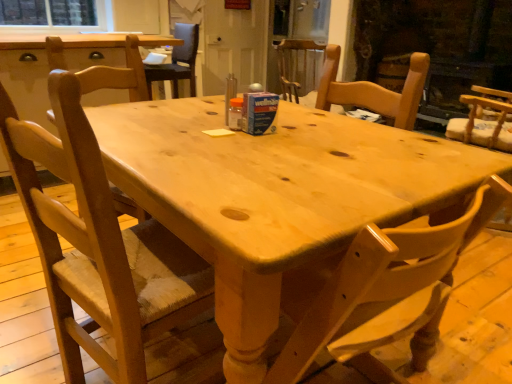
Question: Which direction should I rotate to face white glossy door at upper center, which ranks as the 1th screen door in left-to-right order, — up or down?

Choices:
 (A) down
 (B) up

Answer: (B)

Question: Does light wood chair at center, which is the first chair from back to front, have a lesser height compared to clear glass window screen at upper left?

Choices:
 (A) yes
 (B) no

Answer: (B)

Question: Is clear glass window screen at upper left surrounded by light wood chair at center, which is the second chair from right to left?

Choices:
 (A) no
 (B) yes

Answer: (A)

Question: Is light wood chair at center, acting as the fifth chair starting from the front, turned away from clear glass window screen at upper left?

Choices:
 (A) no
 (B) yes

Answer: (A)

Question: Is light wood chair at center, acting as the fifth chair starting from the front, positioned behind clear glass window screen at upper left?

Choices:
 (A) no
 (B) yes

Answer: (A)

Question: Are light wood chair at center, which is the second chair from right to left, and clear glass window screen at upper left beside each other?

Choices:
 (A) no
 (B) yes

Answer: (A)

Question: Could you tell me if light wood chair at center, acting as the fifth chair starting from the front, is facing clear glass window screen at upper left?

Choices:
 (A) no
 (B) yes

Answer: (A)

Question: From the image's perspective, would you say transparent glass screen door at upper center, which ranks as the 1th screen door in right-to-left order, is shown under white glossy door at upper center, positioned as the second screen door in right-to-left order?

Choices:
 (A) no
 (B) yes

Answer: (B)

Question: Does transparent glass screen door at upper center, which is the second screen door in left-to-right order, lie behind white glossy door at upper center, which ranks as the 1th screen door in left-to-right order?

Choices:
 (A) yes
 (B) no

Answer: (B)

Question: From a real-world perspective, is transparent glass screen door at upper center, which is the second screen door in left-to-right order, positioned under white glossy door at upper center, positioned as the second screen door in right-to-left order, based on gravity?

Choices:
 (A) yes
 (B) no

Answer: (B)

Question: Is transparent glass screen door at upper center, which ranks as the 1th screen door in right-to-left order, facing away from white glossy door at upper center, positioned as the second screen door in right-to-left order?

Choices:
 (A) no
 (B) yes

Answer: (A)

Question: Are transparent glass screen door at upper center, which ranks as the 1th screen door in right-to-left order, and white glossy door at upper center, positioned as the second screen door in right-to-left order, making contact?

Choices:
 (A) yes
 (B) no

Answer: (B)

Question: Would you say white glossy door at upper center, positioned as the second screen door in right-to-left order, is part of transparent glass screen door at upper center, which is the second screen door in left-to-right order,'s contents?

Choices:
 (A) no
 (B) yes

Answer: (A)

Question: Considering the relative sizes of transparent glass screen door at upper center, which ranks as the 1th screen door in right-to-left order, and wooden chair at center, the 5th chair in the right-to-left sequence, in the image provided, is transparent glass screen door at upper center, which ranks as the 1th screen door in right-to-left order, wider than wooden chair at center, the 5th chair in the right-to-left sequence,?

Choices:
 (A) no
 (B) yes

Answer: (B)